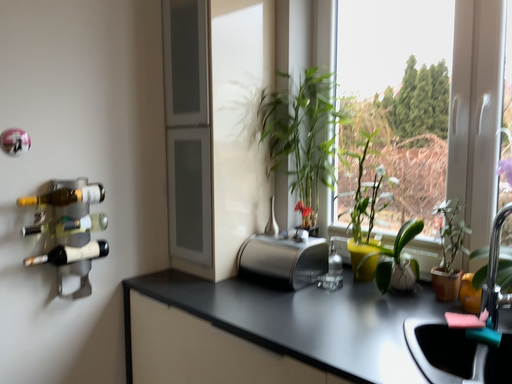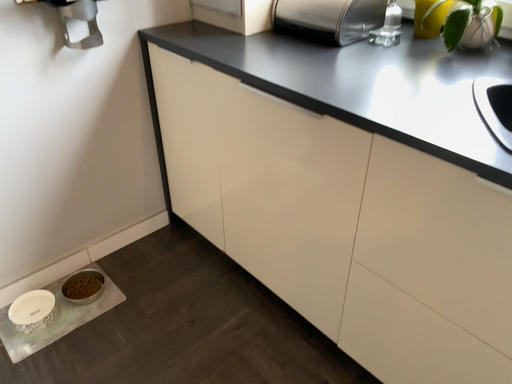
Question: Which way did the camera rotate in the video?

Choices:
 (A) rotated downward
 (B) rotated upward

Answer: (A)